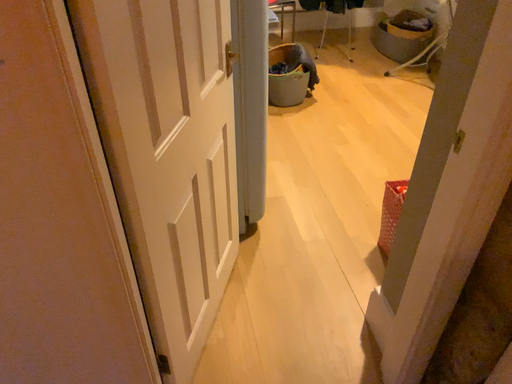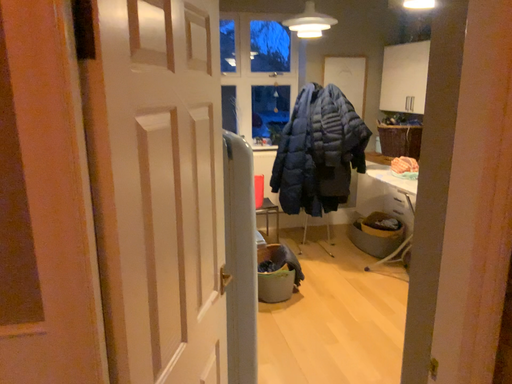
Question: How did the camera likely rotate when shooting the video?

Choices:
 (A) rotated downward
 (B) rotated upward

Answer: (B)